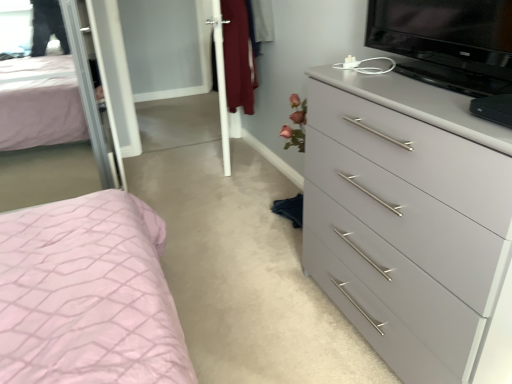
You are a GUI agent. You are given a task and a screenshot of the screen. Output one action in this format:
    pyautogui.click(x=<x>, y=<y>)
    Task: Click on the free region on the left part of matte gray chest of drawers at right
    Image resolution: width=512 pixels, height=384 pixels.
    Given the screenshot: What is the action you would take?
    pyautogui.click(x=261, y=315)